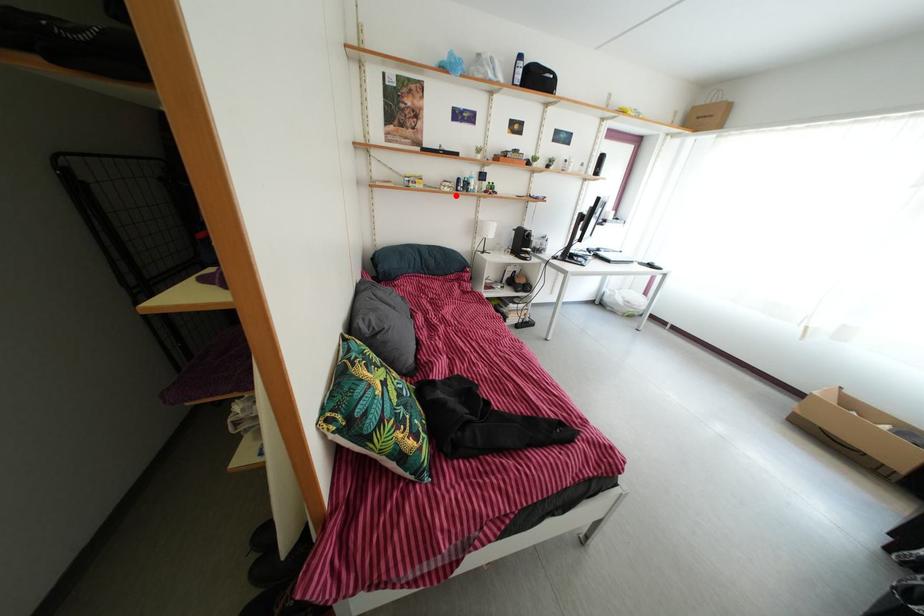
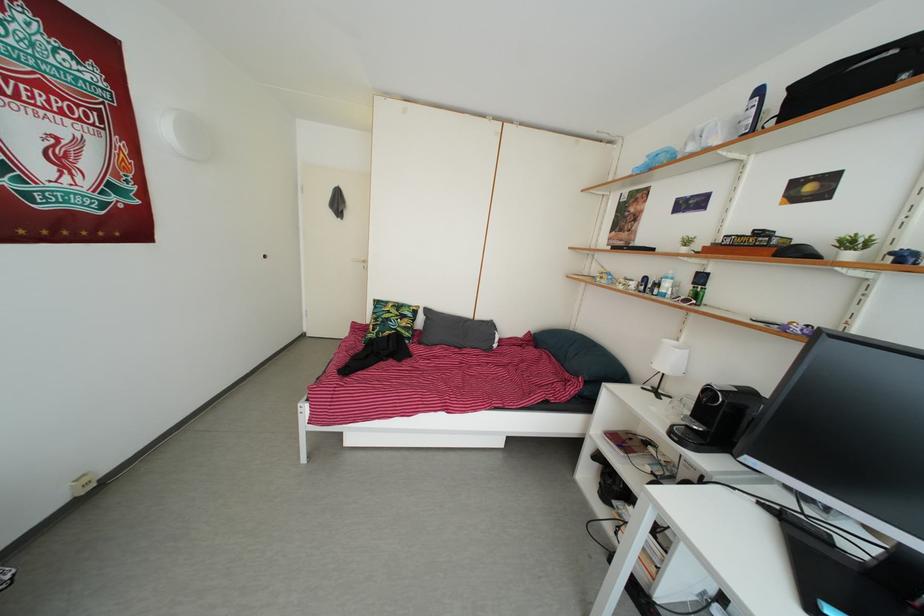
In the second image, find the point that corresponds to the highlighted location in the first image.

(630, 293)